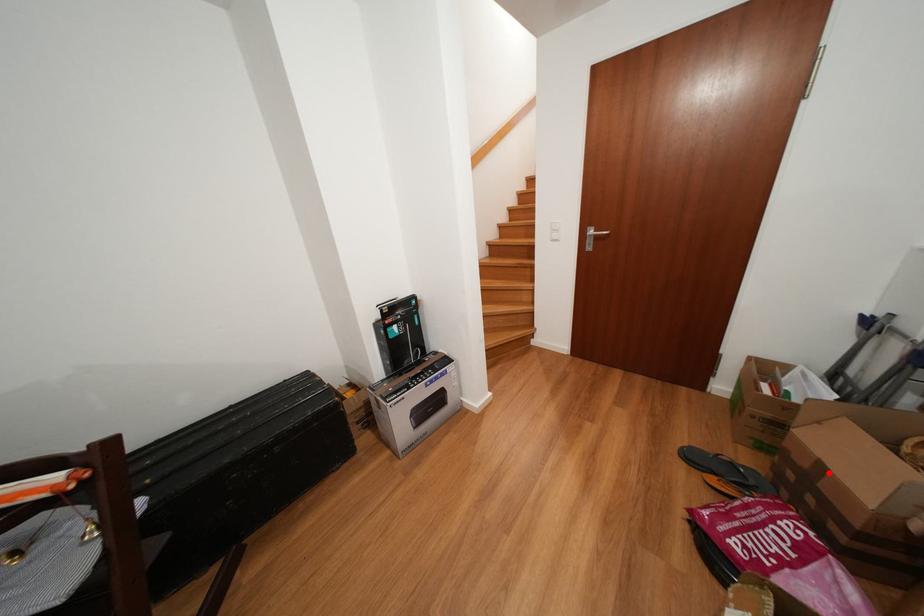
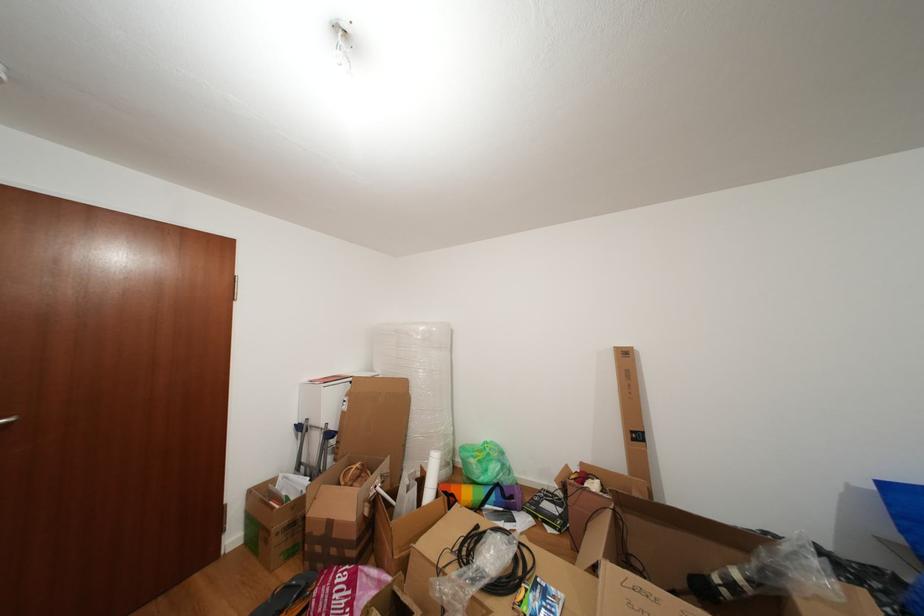
Find the pixel in the second image that matches the highlighted location in the first image.

(338, 529)